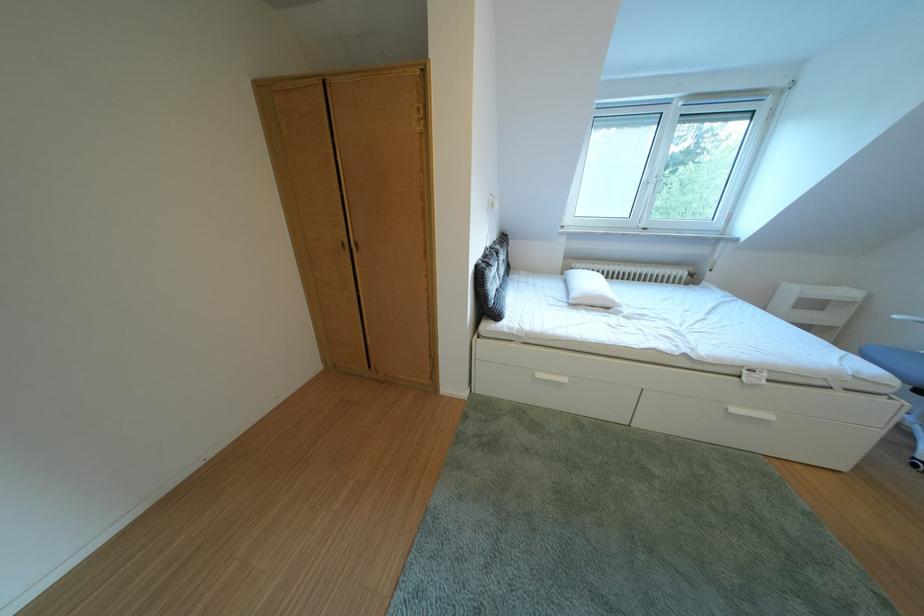
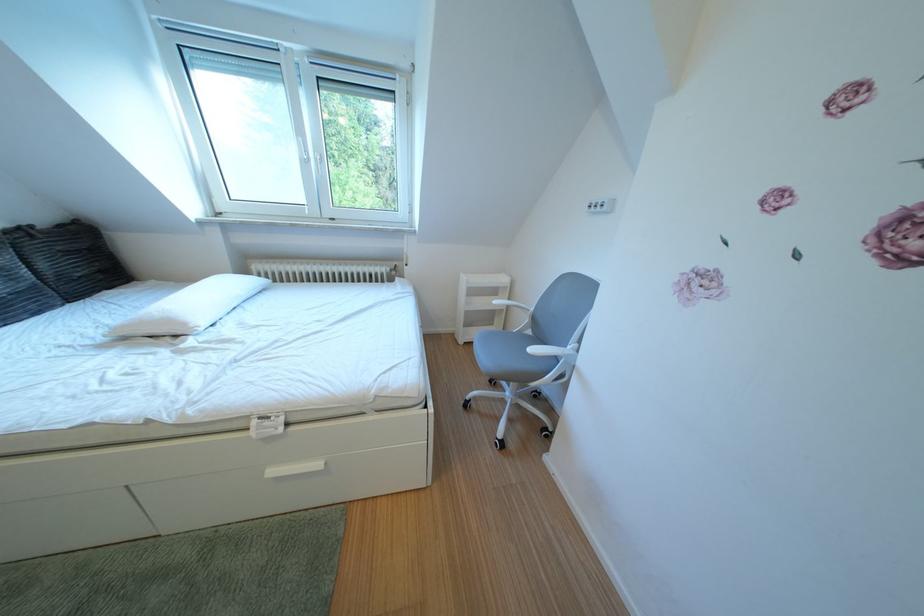
Question: The images are taken continuously from a first-person perspective. In which direction are you moving?

Choices:
 (A) Left
 (B) Right
 (C) Forward
 (D) Backward

Answer: (B)